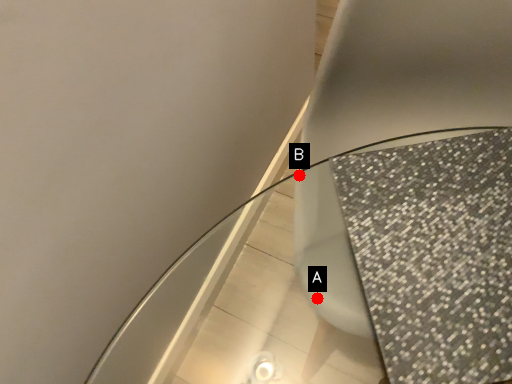
Question: Two points are circled on the image, labeled by A and B beside each circle. Which point is farther to the camera?

Choices:
 (A) A is further
 (B) B is further

Answer: (B)